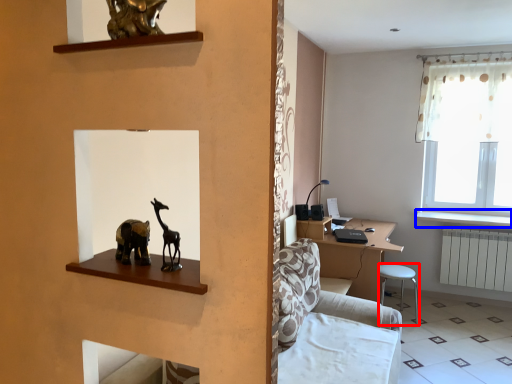
Question: Which point is further to the camera, bar stool (highlighted by a red box) or window sill (highlighted by a blue box)?

Choices:
 (A) bar stool
 (B) window sill

Answer: (B)